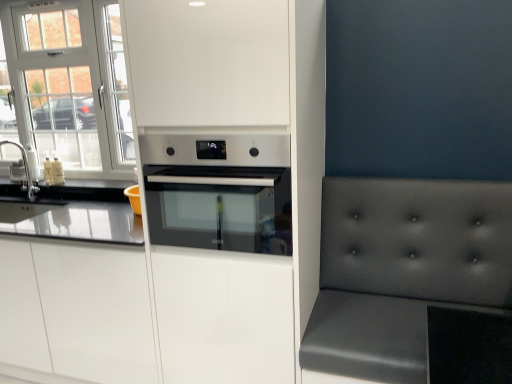
Question: Is matte gray cushion at right wider than white matte cabinet at center, which is the 1th cabinetry from left to right?

Choices:
 (A) yes
 (B) no

Answer: (A)

Question: Can you confirm if matte gray cushion at right is positioned to the left of white matte cabinet at center, which is the 1th cabinetry from left to right?

Choices:
 (A) yes
 (B) no

Answer: (B)

Question: Can you confirm if matte gray cushion at right is bigger than white matte cabinet at center, which is the 1th cabinetry from left to right?

Choices:
 (A) yes
 (B) no

Answer: (B)

Question: Can you confirm if matte gray cushion at right is taller than white matte cabinet at center, which ranks as the second cabinetry in right-to-left order?

Choices:
 (A) yes
 (B) no

Answer: (A)

Question: Considering the relative sizes of matte gray cushion at right and white matte cabinet at center, which ranks as the second cabinetry in right-to-left order, in the image provided, is matte gray cushion at right smaller than white matte cabinet at center, which ranks as the second cabinetry in right-to-left order,?

Choices:
 (A) no
 (B) yes

Answer: (B)

Question: Considering the positions of white matte cabinet at center, which is the 1th cabinetry from left to right, and matte gray cushion at right in the image, is white matte cabinet at center, which is the 1th cabinetry from left to right, taller or shorter than matte gray cushion at right?

Choices:
 (A) tall
 (B) short

Answer: (B)

Question: Would you say white matte cabinet at center, which is the 1th cabinetry from left to right, is to the left or to the right of matte gray cushion at right in the picture?

Choices:
 (A) right
 (B) left

Answer: (B)

Question: From the image's perspective, is white matte cabinet at center, which ranks as the second cabinetry in right-to-left order, located above or below matte gray cushion at right?

Choices:
 (A) above
 (B) below

Answer: (B)

Question: From a real-world perspective, relative to matte gray cushion at right, is white matte cabinet at center, which ranks as the second cabinetry in right-to-left order, vertically above or below?

Choices:
 (A) above
 (B) below

Answer: (B)

Question: Is point (337, 355) closer or farther from the camera than point (28, 182)?

Choices:
 (A) closer
 (B) farther

Answer: (A)

Question: Visually, is matte gray cushion at right positioned to the left or to the right of brushed metal sink at left?

Choices:
 (A) left
 (B) right

Answer: (B)

Question: From a real-world perspective, relative to brushed metal sink at left, is matte gray cushion at right vertically above or below?

Choices:
 (A) below
 (B) above

Answer: (A)

Question: Considering the positions of matte gray cushion at right and brushed metal sink at left in the image, is matte gray cushion at right taller or shorter than brushed metal sink at left?

Choices:
 (A) short
 (B) tall

Answer: (B)

Question: Considering the positions of white glass window at upper left and white matte oven at center, placed as the second cabinetry when sorted from left to right, in the image, is white glass window at upper left taller or shorter than white matte oven at center, placed as the second cabinetry when sorted from left to right,?

Choices:
 (A) short
 (B) tall

Answer: (A)

Question: Looking at the image, does white glass window at upper left seem bigger or smaller compared to white matte oven at center, placed as the second cabinetry when sorted from left to right?

Choices:
 (A) big
 (B) small

Answer: (B)